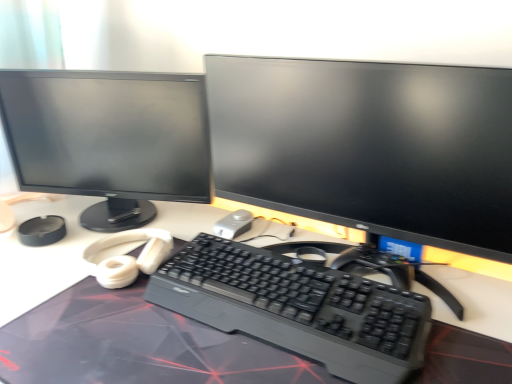
The height and width of the screenshot is (384, 512). Find the location of `unoccupied space behind satin silver mouse at center`. unoccupied space behind satin silver mouse at center is located at coordinates (236, 208).